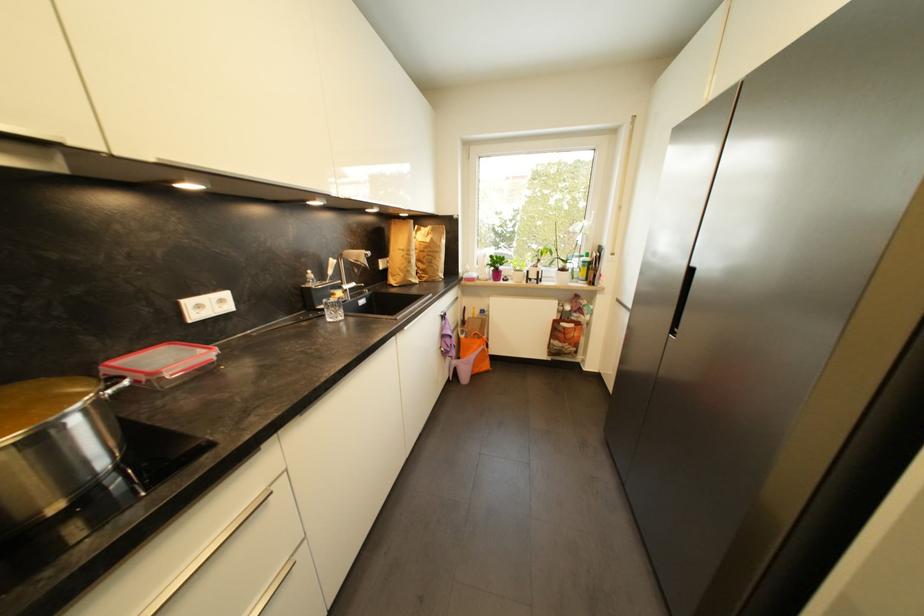
Where is `metal pot handle`? The width and height of the screenshot is (924, 616). metal pot handle is located at coordinates (114, 386).